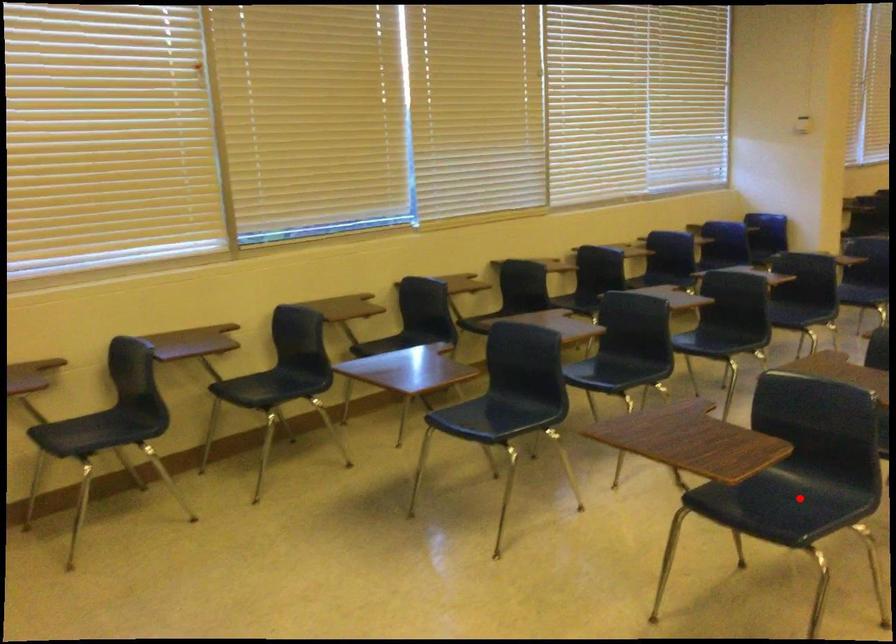
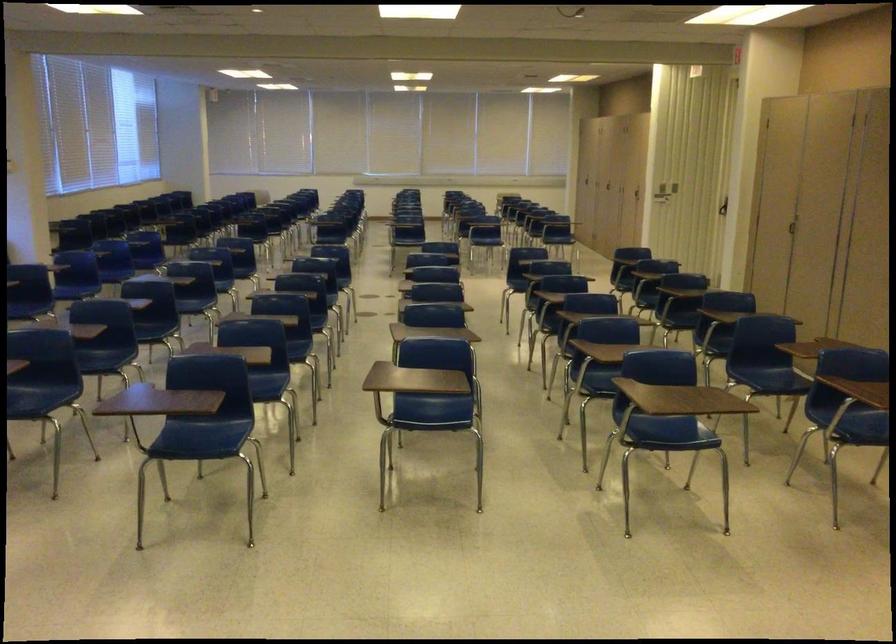
Question: I am providing you with two images of the same scene from different viewpoints. Given a red point in image1, look at the same physical point in image2. Is it:

Choices:
 (A) Closer to the viewpoint
 (B) Farther from the viewpoint

Answer: (B)